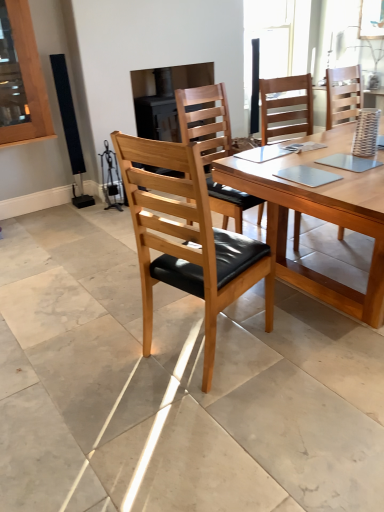
Identify the location of free region under natural wood/black leather chair at center, the third chair in the right-to-left sequence (from a real-world perspective). (202, 346).